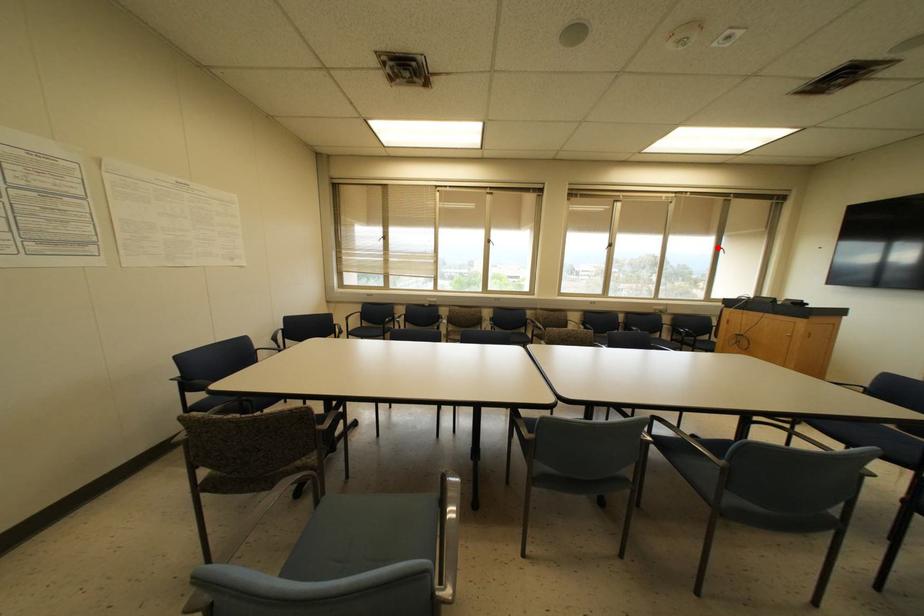
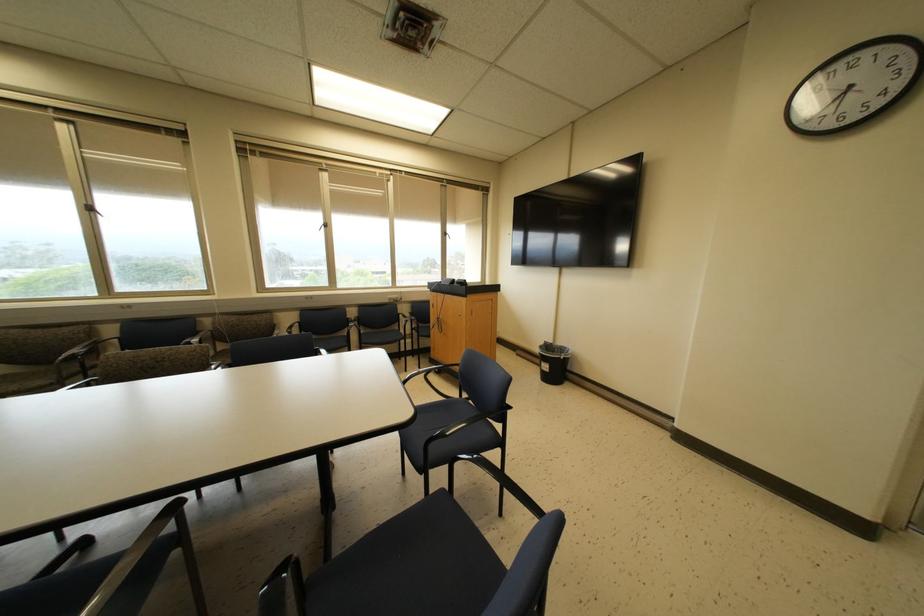
Where in the second image is the point corresponding to the highlighted location from the first image?

(444, 233)